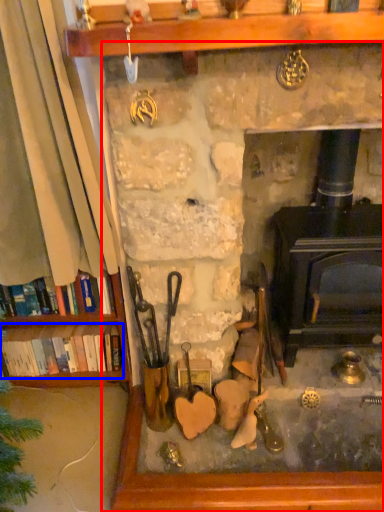
Question: Which point is further to the camera, fireplace (highlighted by a red box) or book (highlighted by a blue box)?

Choices:
 (A) fireplace
 (B) book

Answer: (B)